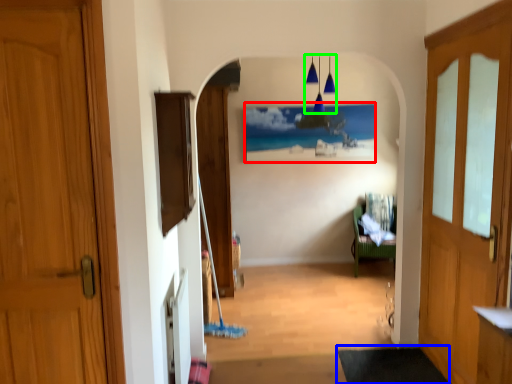
Question: Considering the real-world distances, which object is closest to picture frame (highlighted by a red box)? doormat (highlighted by a blue box) or lamp (highlighted by a green box).

Choices:
 (A) doormat
 (B) lamp

Answer: (B)